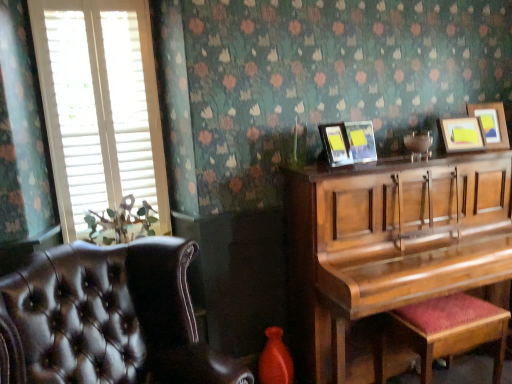
At what (x,y) coordinates should I click in order to perform the action: click on free space in front of matte black picture frame at upper center, the 2th picture frame from the left. Please return your answer as a coordinate pair (x, y). Looking at the image, I should click on (367, 167).